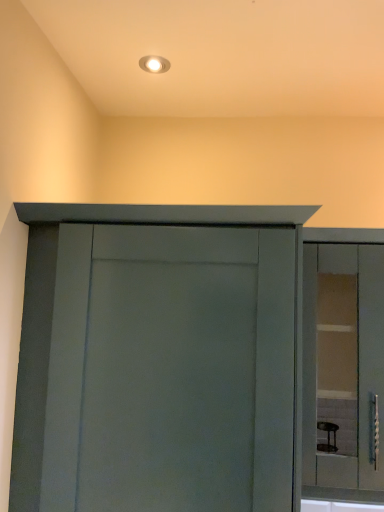
This screenshot has height=512, width=384. Describe the element at coordinates (186, 361) in the screenshot. I see `matte gray cupboard at center` at that location.

Locate an element on the screen. Image resolution: width=384 pixels, height=512 pixels. matte gray cupboard at center is located at coordinates (186, 361).

Describe the element at coordinates (343, 370) in the screenshot. The image size is (384, 512). I see `clear glass cabinet at right` at that location.

Image resolution: width=384 pixels, height=512 pixels. What are the coordinates of `clear glass cabinet at right` in the screenshot? It's located at (343, 370).

Image resolution: width=384 pixels, height=512 pixels. Find the location of `matte gray cupboard at center`. matte gray cupboard at center is located at coordinates (186, 361).

Considering the positions of objects clear glass cabinet at right and matte gray cupboard at center in the image provided, who is more to the right, clear glass cabinet at right or matte gray cupboard at center?

From the viewer's perspective, clear glass cabinet at right appears more on the right side.

Is clear glass cabinet at right positioned before matte gray cupboard at center?

No, clear glass cabinet at right is further to the viewer.

Is point (383, 331) farther from viewer compared to point (153, 380)?

Yes.

From the image's perspective, is clear glass cabinet at right located above matte gray cupboard at center?

Correct, clear glass cabinet at right appears higher than matte gray cupboard at center in the image.

From a real-world perspective, is clear glass cabinet at right positioned under matte gray cupboard at center based on gravity?

No, from a real-world perspective, clear glass cabinet at right is not beneath matte gray cupboard at center.

Can you confirm if clear glass cabinet at right is thinner than matte gray cupboard at center?

Correct, the width of clear glass cabinet at right is less than that of matte gray cupboard at center.

Between clear glass cabinet at right and matte gray cupboard at center, which one has less height?

clear glass cabinet at right is shorter.

Is clear glass cabinet at right bigger or smaller than matte gray cupboard at center?

clear glass cabinet at right is smaller than matte gray cupboard at center.

Is matte gray cupboard at center a part of clear glass cabinet at right?

No, matte gray cupboard at center is not surrounded by clear glass cabinet at right.

Is clear glass cabinet at right far away from matte gray cupboard at center?

No, there isn't a large distance between clear glass cabinet at right and matte gray cupboard at center.

Looking at this image, is clear glass cabinet at right oriented towards matte gray cupboard at center?

No.

Image resolution: width=384 pixels, height=512 pixels. Identify the location of cupboard that is below the clear glass cabinet at right (from the image's perspective). (186, 361).

Which is more to the right, matte gray cupboard at center or clear glass cabinet at right?

From the viewer's perspective, clear glass cabinet at right appears more on the right side.

Is matte gray cupboard at center in front of clear glass cabinet at right?

Yes, it is in front of clear glass cabinet at right.

Is point (373, 434) positioned behind point (315, 328)?

That is False.

From the image's perspective, is matte gray cupboard at center beneath clear glass cabinet at right?

Yes, from the image's perspective, matte gray cupboard at center is beneath clear glass cabinet at right.

From a real-world perspective, is matte gray cupboard at center physically located above or below clear glass cabinet at right?

matte gray cupboard at center is situated lower than clear glass cabinet at right in the real world.

Which object is wider, matte gray cupboard at center or clear glass cabinet at right?

matte gray cupboard at center.

Is matte gray cupboard at center taller or shorter than clear glass cabinet at right?

Considering their sizes, matte gray cupboard at center has more height than clear glass cabinet at right.

Looking at the image, does matte gray cupboard at center seem bigger or smaller compared to clear glass cabinet at right?

Clearly, matte gray cupboard at center is larger in size than clear glass cabinet at right.

Which is correct: matte gray cupboard at center is inside clear glass cabinet at right, or outside of it?

matte gray cupboard at center is spatially situated outside clear glass cabinet at right.

Does matte gray cupboard at center touch clear glass cabinet at right?

matte gray cupboard at center is not next to clear glass cabinet at right, and they're not touching.

Is matte gray cupboard at center oriented towards clear glass cabinet at right?

No.

Can you tell me how much matte gray cupboard at center and clear glass cabinet at right differ in facing direction?

They differ by 0.00179 degrees in their facing directions.

I want to click on window behind the matte gray cupboard at center, so click(x=343, y=370).

Where is `window on the right side of matte gray cupboard at center`? The height and width of the screenshot is (512, 384). window on the right side of matte gray cupboard at center is located at coordinates (343, 370).

Where is `cupboard that is on the left side of clear glass cabinet at right`? Image resolution: width=384 pixels, height=512 pixels. cupboard that is on the left side of clear glass cabinet at right is located at coordinates (186, 361).